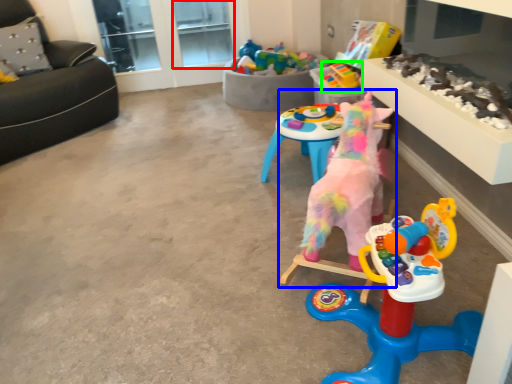
Question: Which object is positioned farthest from window screen (highlighted by a red box)? Select from toy (highlighted by a blue box) and toy (highlighted by a green box).

Choices:
 (A) toy
 (B) toy

Answer: (A)